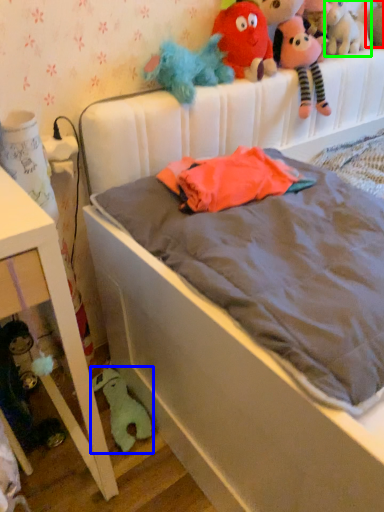
Question: Which object is the farthest from toy (highlighted by a red box)? Choose among these: toy (highlighted by a blue box) or toy (highlighted by a green box).

Choices:
 (A) toy
 (B) toy

Answer: (A)